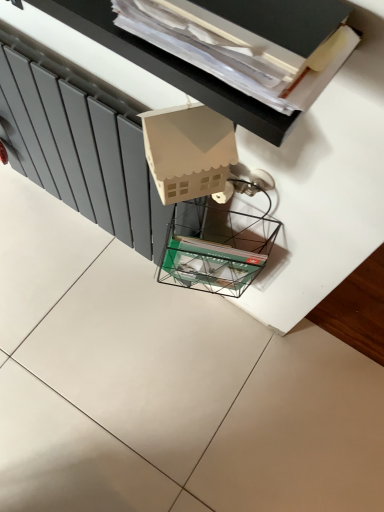
Question: From the image's perspective, would you say matte cardboard house at upper center is positioned over matte gray radiator at left?

Choices:
 (A) no
 (B) yes

Answer: (B)

Question: Does matte cardboard house at upper center come in front of matte gray radiator at left?

Choices:
 (A) no
 (B) yes

Answer: (B)

Question: Is matte cardboard house at upper center not within matte gray radiator at left?

Choices:
 (A) yes
 (B) no

Answer: (A)

Question: Is matte cardboard house at upper center facing away from matte gray radiator at left?

Choices:
 (A) yes
 (B) no

Answer: (B)

Question: Is matte cardboard house at upper center to the left of matte gray radiator at left from the viewer's perspective?

Choices:
 (A) yes
 (B) no

Answer: (B)

Question: From a real-world perspective, is matte cardboard house at upper center above or below clear glass magazine rack at center?

Choices:
 (A) below
 (B) above

Answer: (B)

Question: From their relative heights in the image, would you say matte cardboard house at upper center is taller or shorter than clear glass magazine rack at center?

Choices:
 (A) short
 (B) tall

Answer: (A)

Question: Looking at their shapes, would you say matte cardboard house at upper center is wider or thinner than clear glass magazine rack at center?

Choices:
 (A) wide
 (B) thin

Answer: (A)

Question: Would you say matte cardboard house at upper center is to the left or to the right of clear glass magazine rack at center in the picture?

Choices:
 (A) right
 (B) left

Answer: (B)

Question: From the image's perspective, is matte cardboard house at upper center above or below matte gray radiator at left?

Choices:
 (A) above
 (B) below

Answer: (A)

Question: Considering the positions of matte cardboard house at upper center and matte gray radiator at left in the image, is matte cardboard house at upper center bigger or smaller than matte gray radiator at left?

Choices:
 (A) big
 (B) small

Answer: (B)

Question: Considering the positions of matte cardboard house at upper center and matte gray radiator at left in the image, is matte cardboard house at upper center wider or thinner than matte gray radiator at left?

Choices:
 (A) thin
 (B) wide

Answer: (B)

Question: From their relative heights in the image, would you say matte cardboard house at upper center is taller or shorter than matte gray radiator at left?

Choices:
 (A) short
 (B) tall

Answer: (A)

Question: Choose the correct answer: Is matte gray radiator at left inside matte cardboard house at upper center or outside it?

Choices:
 (A) inside
 (B) outside

Answer: (B)

Question: Is matte gray radiator at left in front of or behind matte cardboard house at upper center in the image?

Choices:
 (A) front
 (B) behind

Answer: (B)